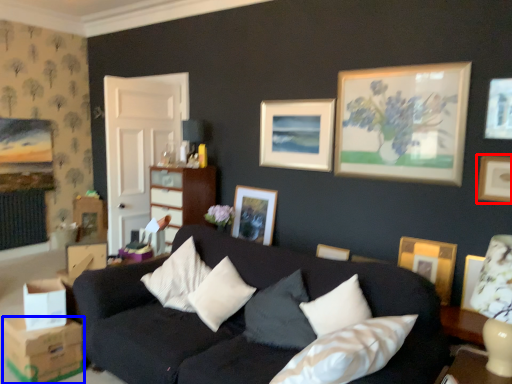
Question: Which point is further to the camera, picture frame (highlighted by a red box) or cardboard box (highlighted by a blue box)?

Choices:
 (A) picture frame
 (B) cardboard box

Answer: (A)